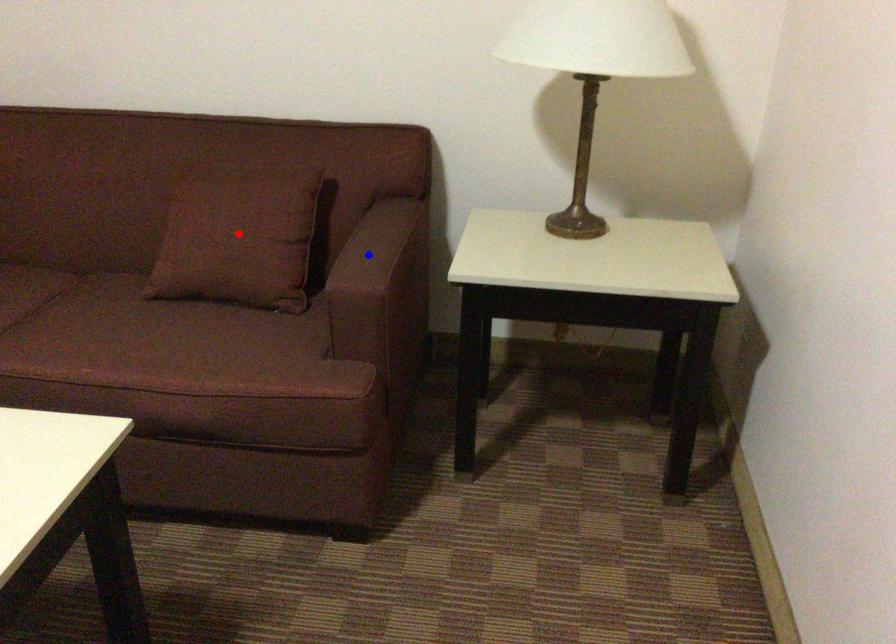
Question: Which of the two points in the image is closer to the camera?

Choices:
 (A) Blue point is closer.
 (B) Red point is closer.

Answer: (A)